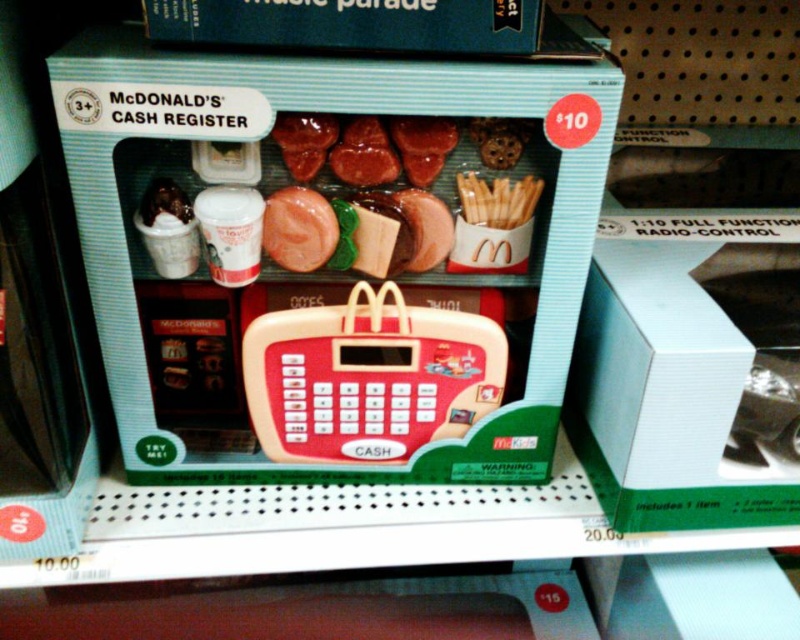
You are a customer at the toy store looking at the packaged toy cash register. You see the white cardboard box at right and the blue cardboard box at upper center. Which box is thicker?

The blue cardboard box at upper center is thicker than the white cardboard box at right.

From the picture: You are a customer trying to place an order at the toy McDonalds cash register. You notice two points on the packaging, one at point (752, 515) and the other at point (274, 20). Which point is closer to you?

Point (752, 515) is further to the viewer than point (274, 20), so the point at (274, 20) is closer to you.

You are a child who wants to place the white cardboard box at right into the matte plastic toy cash register at center. Based on their sizes, can you do that?

The matte plastic toy cash register at center is larger in size than the white cardboard box at right, so yes, the white cardboard box at right can fit inside the matte plastic toy cash register at center.